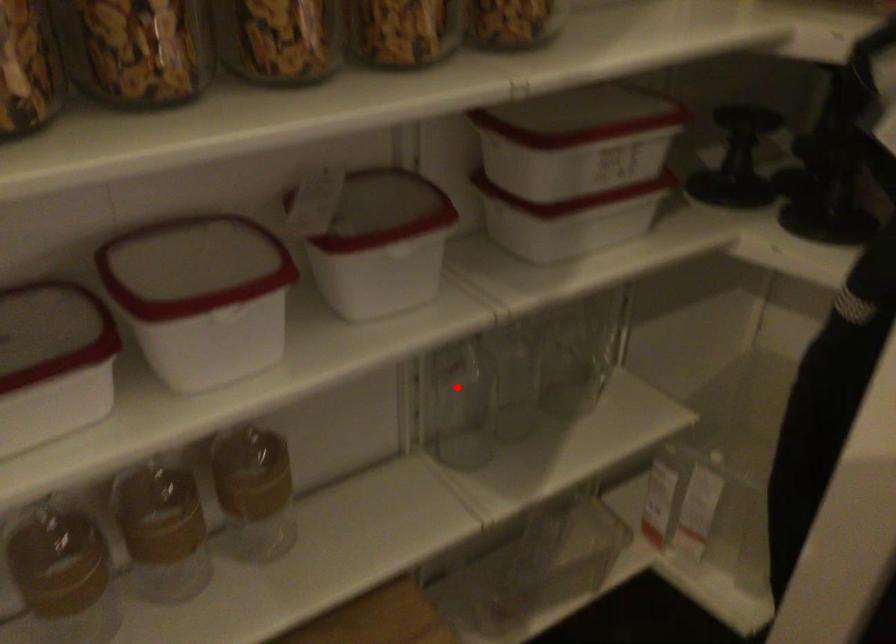
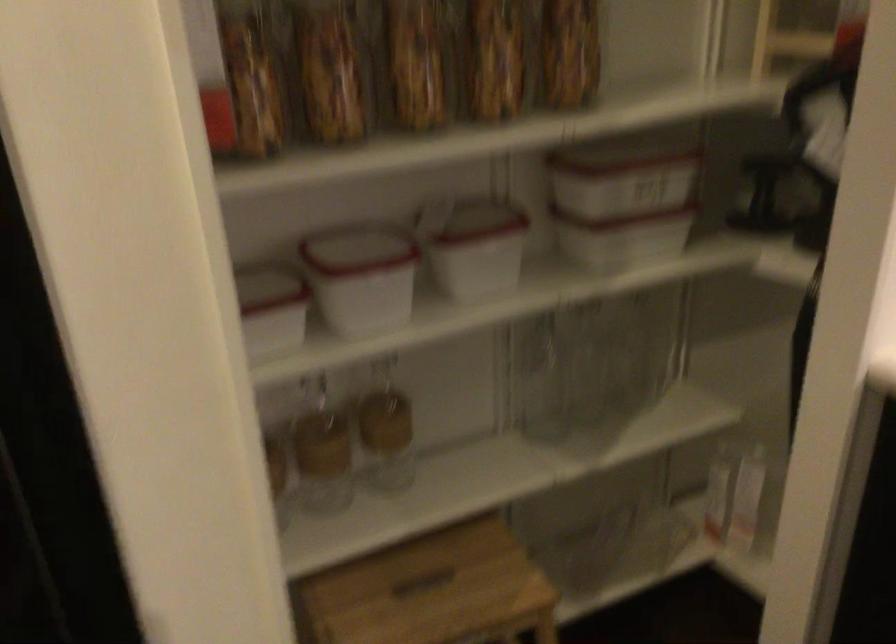
Question: I am providing you with two images of the same scene from different viewpoints. Image1 has a red point marked. In image2, the corresponding 3D location appears at what relative position? Reply with the corresponding letter.

Choices:
 (A) Closer
 (B) Farther

Answer: (B)